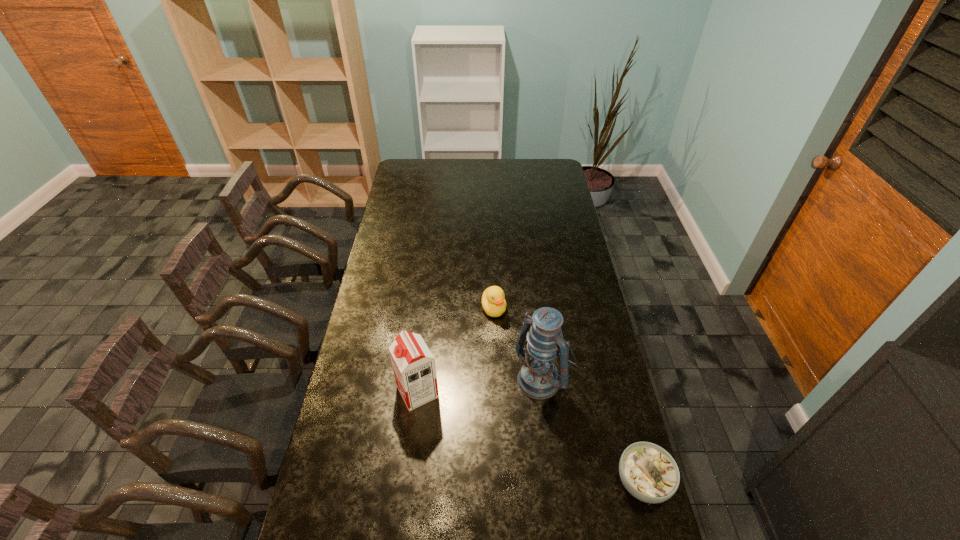
In order to click on soya milk in this screenshot , I will do `click(413, 364)`.

This screenshot has width=960, height=540. What are the coordinates of `the leftmost object` in the screenshot? It's located at (413, 364).

This screenshot has width=960, height=540. I want to click on the shortest object, so click(x=648, y=472).

You are a GUI agent. You are given a task and a screenshot of the screen. Output one action in this format:
    pyautogui.click(x=<x>, y=<y>)
    Task: Click on the rightmost object
    Image resolution: width=960 pixels, height=540 pixels.
    Given the screenshot: What is the action you would take?
    pyautogui.click(x=648, y=472)

In order to click on lantern in this screenshot , I will do `click(538, 378)`.

Where is `the second object from right to left`? This screenshot has height=540, width=960. the second object from right to left is located at coordinates (538, 378).

The height and width of the screenshot is (540, 960). I want to click on the farthest object, so click(x=493, y=299).

Locate an element on the screen. the second shortest object is located at coordinates (493, 299).

Identify the location of vacant area situated 0.400m on the back of the leftmost object. Image resolution: width=960 pixels, height=540 pixels. (429, 291).

What are the coordinates of `free location located 0.190m on the back of the nearest object` in the screenshot? It's located at (621, 398).